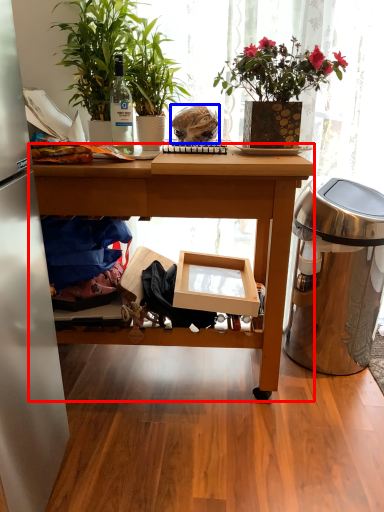
Question: Which object is further to the camera taking this photo, desk (highlighted by a red box) or food (highlighted by a blue box)?

Choices:
 (A) desk
 (B) food

Answer: (B)